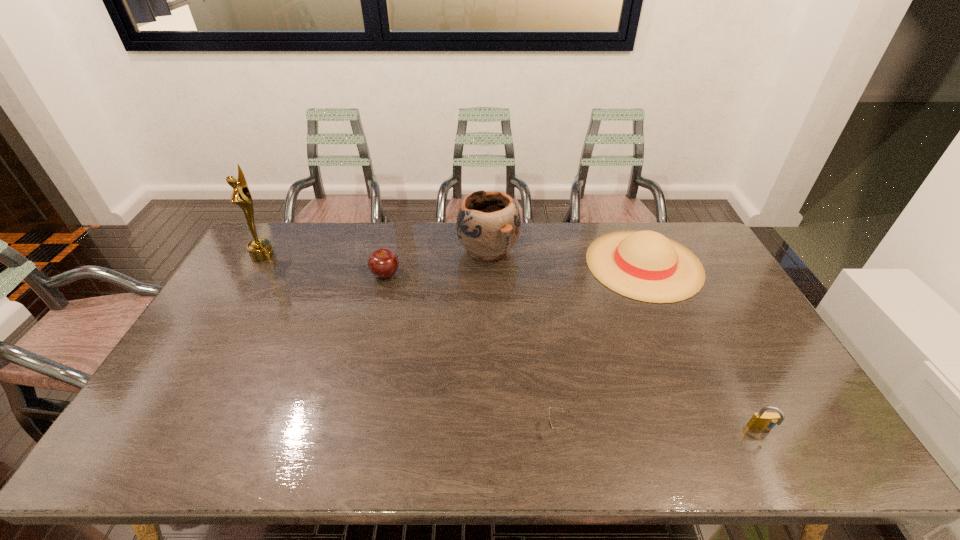
What are the coordinates of `award` in the screenshot? It's located at (260, 249).

The width and height of the screenshot is (960, 540). In order to click on the leftmost object in this screenshot , I will do `click(260, 249)`.

You are a GUI agent. You are given a task and a screenshot of the screen. Output one action in this format:
    pyautogui.click(x=<x>, y=<y>)
    Task: Click on the pottery
    This screenshot has height=540, width=960.
    Given the screenshot: What is the action you would take?
    pyautogui.click(x=488, y=225)

Locate an element on the screen. the second tallest object is located at coordinates (488, 225).

Where is `sombrero`? sombrero is located at coordinates (645, 265).

Locate an element on the screen. This screenshot has width=960, height=540. the fifth object from right to left is located at coordinates (383, 263).

Identify the location of padlock. This screenshot has width=960, height=540. (763, 420).

The width and height of the screenshot is (960, 540). What are the coordinates of `sunglasses` in the screenshot? It's located at (550, 424).

This screenshot has width=960, height=540. Identify the location of the shortest object. (550, 424).

What are the coordinates of `vacant area located 0.190m on the front-facing side of the leftmost object` in the screenshot? It's located at (326, 254).